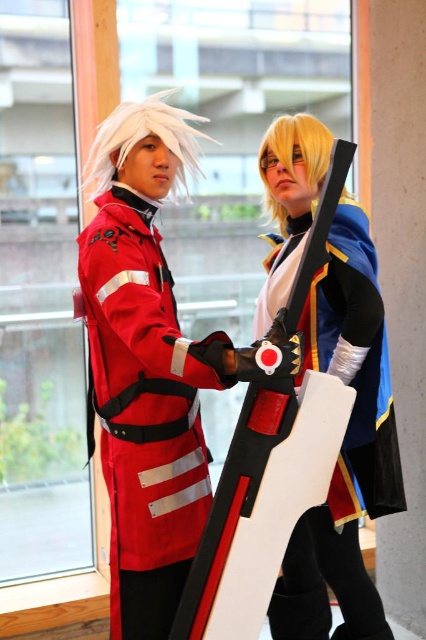
Is matte red uniform at center to the right of shiny gold armor at center from the viewer's perspective?

Incorrect, matte red uniform at center is not on the right side of shiny gold armor at center.

Can you confirm if matte red uniform at center is wider than shiny gold armor at center?

Yes.

Between point (262, 144) and point (379, 497), which one is positioned behind?

Positioned behind is point (262, 144).

The width and height of the screenshot is (426, 640). Find the location of `matte red uniform at center`. matte red uniform at center is located at coordinates (146, 365).

Who is positioned more to the left, matte red uniform at center or matte red fabric uniform at left?

matte red fabric uniform at left is more to the left.

Measure the distance between point (97, 333) and camera.

5.48 feet

Locate an element on the screen. The image size is (426, 640). matte red uniform at center is located at coordinates (146, 365).

At what (x,y) coordinates should I click in order to perform the action: click on matte red uniform at center. Please return your answer as a coordinate pair (x, y). The width and height of the screenshot is (426, 640). Looking at the image, I should click on (146, 365).

Is matte red fabric uniform at left below shiny gold armor at center?

Indeed, matte red fabric uniform at left is positioned under shiny gold armor at center.

Between point (97, 378) and point (368, 241), which one is positioned behind?

Point (368, 241)

Image resolution: width=426 pixels, height=640 pixels. I want to click on matte red fabric uniform at left, so click(x=143, y=397).